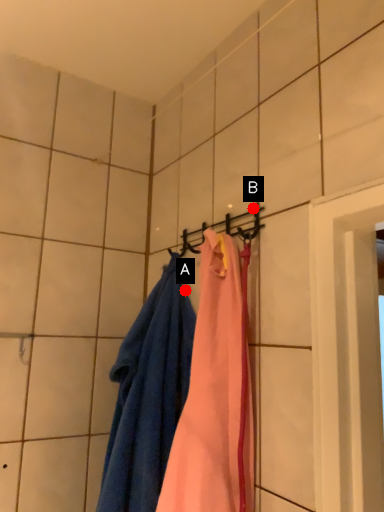
Question: Two points are circled on the image, labeled by A and B beside each circle. Among these points, which one is nearest to the camera?

Choices:
 (A) A is closer
 (B) B is closer

Answer: (B)